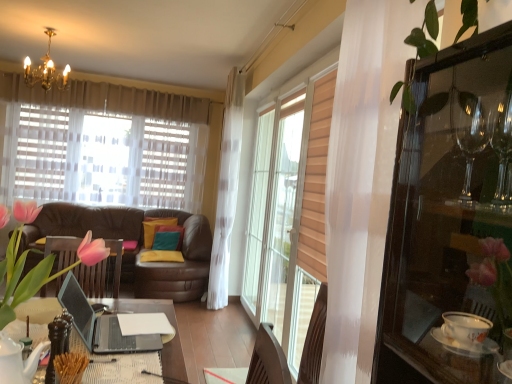
In order to face teal fabric pillow at center, placed as the 2th pillow when sorted from front to back, should I rotate leftwards or rightwards?

Turn left approximately 11.810 degrees to face it.

This screenshot has height=384, width=512. Describe the element at coordinates (38, 263) in the screenshot. I see `pink silk tulips at center` at that location.

Describe the element at coordinates (155, 228) in the screenshot. I see `teal fabric pillow at center, which ranks as the third pillow in front-to-back order` at that location.

At what (x,y) coordinates should I click in order to perform the action: click on transparent glass cabinet at right. Please return your answer as a coordinate pair (x, y). The image size is (512, 384). Looking at the image, I should click on (449, 217).

Measure the distance from teal fabric pillow at center, which ranks as the third pillow in front-to-back order, to yellow fabric pillow at center, the first pillow when ordered from front to back.

A distance of 8.91 inches exists between teal fabric pillow at center, which ranks as the third pillow in front-to-back order, and yellow fabric pillow at center, the first pillow when ordered from front to back.

Is teal fabric pillow at center, marked as the 1th pillow in a back-to-front arrangement, closer to camera compared to yellow fabric pillow at center, the first pillow when ordered from front to back?

That is False.

Considering the positions of objects teal fabric pillow at center, marked as the 1th pillow in a back-to-front arrangement, and yellow fabric pillow at center, the first pillow when ordered from front to back, in the image provided, who is more to the left, teal fabric pillow at center, marked as the 1th pillow in a back-to-front arrangement, or yellow fabric pillow at center, the first pillow when ordered from front to back,?

teal fabric pillow at center, marked as the 1th pillow in a back-to-front arrangement.

Considering the sizes of objects teal fabric pillow at center, marked as the 1th pillow in a back-to-front arrangement, and yellow fabric pillow at center, the first pillow when ordered from front to back, in the image provided, who is bigger, teal fabric pillow at center, marked as the 1th pillow in a back-to-front arrangement, or yellow fabric pillow at center, the first pillow when ordered from front to back,?

Bigger between the two is teal fabric pillow at center, marked as the 1th pillow in a back-to-front arrangement.

Is there a large distance between pink silk tulips at center and teal fabric pillow at center, marked as the 1th pillow in a back-to-front arrangement?

Yes.

Is pink silk tulips at center looking in the opposite direction of teal fabric pillow at center, marked as the 1th pillow in a back-to-front arrangement?

No, pink silk tulips at center is not facing the opposite direction of teal fabric pillow at center, marked as the 1th pillow in a back-to-front arrangement.

Is pink silk tulips at center at the left side of teal fabric pillow at center, which ranks as the third pillow in front-to-back order?

No.

Is pink silk tulips at center positioned in front of teal fabric pillow at center, marked as the 1th pillow in a back-to-front arrangement?

Yes, pink silk tulips at center is closer to the viewer.

Consider the image. Is teal fabric pillow at center, marked as the 1th pillow in a back-to-front arrangement, in front of or behind teal fabric pillow at center, placed as the 2th pillow when sorted from front to back, in the image?

teal fabric pillow at center, marked as the 1th pillow in a back-to-front arrangement, is behind teal fabric pillow at center, placed as the 2th pillow when sorted from front to back.

Could you tell me if teal fabric pillow at center, which ranks as the third pillow in front-to-back order, is facing teal fabric pillow at center, placed as the 2th pillow when sorted from front to back?

Yes, teal fabric pillow at center, which ranks as the third pillow in front-to-back order, is turned towards teal fabric pillow at center, placed as the 2th pillow when sorted from front to back.

From the image's perspective, is teal fabric pillow at center, marked as the 1th pillow in a back-to-front arrangement, located beneath teal fabric pillow at center, which ranks as the second pillow in back-to-front order?

Actually, teal fabric pillow at center, marked as the 1th pillow in a back-to-front arrangement, appears above teal fabric pillow at center, which ranks as the second pillow in back-to-front order, in the image.

Which of these two, teal fabric pillow at center, which ranks as the third pillow in front-to-back order, or teal fabric pillow at center, placed as the 2th pillow when sorted from front to back, stands taller?

teal fabric pillow at center, which ranks as the third pillow in front-to-back order.

Considering the relative positions of pink silk tulips at center and yellow fabric pillow at center, the first pillow when ordered from front to back, in the image provided, is pink silk tulips at center to the left of yellow fabric pillow at center, the first pillow when ordered from front to back, from the viewer's perspective?

No, pink silk tulips at center is not to the left of yellow fabric pillow at center, the first pillow when ordered from front to back.

Is pink silk tulips at center oriented away from yellow fabric pillow at center, the third pillow from the back?

No, pink silk tulips at center's orientation is not away from yellow fabric pillow at center, the third pillow from the back.

Is pink silk tulips at center not inside yellow fabric pillow at center, the first pillow when ordered from front to back?

Indeed, pink silk tulips at center is completely outside yellow fabric pillow at center, the first pillow when ordered from front to back.

Which of these two, pink silk tulips at center or yellow fabric pillow at center, the first pillow when ordered from front to back, stands shorter?

Standing shorter between the two is yellow fabric pillow at center, the first pillow when ordered from front to back.

Is yellow fabric pillow at center, the third pillow from the back, facing away from pink silk tulips at center?

yellow fabric pillow at center, the third pillow from the back, does not have its back to pink silk tulips at center.

Which is more to the right, yellow fabric pillow at center, the first pillow when ordered from front to back, or pink silk tulips at center?

Positioned to the right is pink silk tulips at center.

From the image's perspective, which object appears higher, yellow fabric pillow at center, the first pillow when ordered from front to back, or pink silk tulips at center?

pink silk tulips at center is shown above in the image.

Visually, is pink silk tulips at center positioned to the left or to the right of transparent glass cabinet at right?

pink silk tulips at center is to the left of transparent glass cabinet at right.

Can we say pink silk tulips at center lies outside transparent glass cabinet at right?

pink silk tulips at center lies outside transparent glass cabinet at right's area.

The image size is (512, 384). Identify the location of floral arrangement that appears below the transparent glass cabinet at right (from a real-world perspective). (38, 263).

Which pillow is the 1st one when counting from the left side of the yellow fabric pillow at center, the first pillow when ordered from front to back? Please provide its 2D coordinates.

[(168, 237)]

From a real-world perspective, is teal fabric pillow at center, placed as the 2th pillow when sorted from front to back, positioned above or below yellow fabric pillow at center, the third pillow from the back?

In terms of real-world spatial position, teal fabric pillow at center, placed as the 2th pillow when sorted from front to back, is above yellow fabric pillow at center, the third pillow from the back.

Is yellow fabric pillow at center, the third pillow from the back, a part of teal fabric pillow at center, which ranks as the second pillow in back-to-front order?

That's incorrect, yellow fabric pillow at center, the third pillow from the back, is not inside teal fabric pillow at center, which ranks as the second pillow in back-to-front order.

Considering the relative positions of teal fabric pillow at center, which ranks as the second pillow in back-to-front order, and yellow fabric pillow at center, the first pillow when ordered from front to back, in the image provided, is teal fabric pillow at center, which ranks as the second pillow in back-to-front order, to the left of yellow fabric pillow at center, the first pillow when ordered from front to back, from the viewer's perspective?

Yes.

I want to click on the 2nd pillow behind the yellow fabric pillow at center, the third pillow from the back, so click(155, 228).

From a real-world perspective, count 1st pillows downward from the pink silk tulips at center and point to it. Please provide its 2D coordinates.

[(155, 228)]

Looking at the image, which one is located closer to yellow fabric pillow at center, the first pillow when ordered from front to back, teal fabric pillow at center, which ranks as the second pillow in back-to-front order, or pink silk tulips at center?

Based on the image, teal fabric pillow at center, which ranks as the second pillow in back-to-front order, appears to be nearer to yellow fabric pillow at center, the first pillow when ordered from front to back.

Based on their spatial positions, is teal fabric pillow at center, marked as the 1th pillow in a back-to-front arrangement, or transparent glass cabinet at right further from pink silk tulips at center?

Among the two, teal fabric pillow at center, marked as the 1th pillow in a back-to-front arrangement, is located further to pink silk tulips at center.

Consider the image. Which object lies further to the anchor point teal fabric pillow at center, placed as the 2th pillow when sorted from front to back, yellow fabric pillow at center, the first pillow when ordered from front to back, or transparent glass cabinet at right?

The object further to teal fabric pillow at center, placed as the 2th pillow when sorted from front to back, is transparent glass cabinet at right.

Estimate the real-world distances between objects in this image. Which object is further from transparent glass cabinet at right, yellow fabric pillow at center, the third pillow from the back, or teal fabric pillow at center, which ranks as the second pillow in back-to-front order?

Among the two, teal fabric pillow at center, which ranks as the second pillow in back-to-front order, is located further to transparent glass cabinet at right.

From the image, which object appears to be nearer to yellow fabric pillow at center, the first pillow when ordered from front to back, transparent glass cabinet at right or pink silk tulips at center?

Based on the image, pink silk tulips at center appears to be nearer to yellow fabric pillow at center, the first pillow when ordered from front to back.

In the scene shown: Which object lies nearer to the anchor point pink silk tulips at center, transparent glass cabinet at right or teal fabric pillow at center, which ranks as the third pillow in front-to-back order?

Among the two, transparent glass cabinet at right is located nearer to pink silk tulips at center.

Estimate the real-world distances between objects in this image. Which object is further from teal fabric pillow at center, which ranks as the third pillow in front-to-back order, transparent glass cabinet at right or teal fabric pillow at center, placed as the 2th pillow when sorted from front to back?

The object further to teal fabric pillow at center, which ranks as the third pillow in front-to-back order, is transparent glass cabinet at right.

When comparing their distances from transparent glass cabinet at right, does pink silk tulips at center or yellow fabric pillow at center, the first pillow when ordered from front to back, seem closer?

Among the two, pink silk tulips at center is located nearer to transparent glass cabinet at right.

You are a GUI agent. You are given a task and a screenshot of the screen. Output one action in this format:
    pyautogui.click(x=<x>, y=<y>)
    Task: Click on the pillow located between yellow fabric pillow at center, the first pillow when ordered from front to back, and teal fabric pillow at center, which ranks as the third pillow in front-to-back order, in the depth direction
    The height and width of the screenshot is (384, 512).
    Given the screenshot: What is the action you would take?
    pyautogui.click(x=168, y=237)

Where is `floral arrangement between transparent glass cabinet at right and yellow fabric pillow at center, the third pillow from the back, along the z-axis`? floral arrangement between transparent glass cabinet at right and yellow fabric pillow at center, the third pillow from the back, along the z-axis is located at coordinates click(38, 263).

This screenshot has height=384, width=512. Identify the location of pillow between pink silk tulips at center and teal fabric pillow at center, placed as the 2th pillow when sorted from front to back, in the front-back direction. (161, 256).

The image size is (512, 384). What are the coordinates of `floral arrangement between transparent glass cabinet at right and teal fabric pillow at center, marked as the 1th pillow in a back-to-front arrangement, along the z-axis` in the screenshot? It's located at (38, 263).